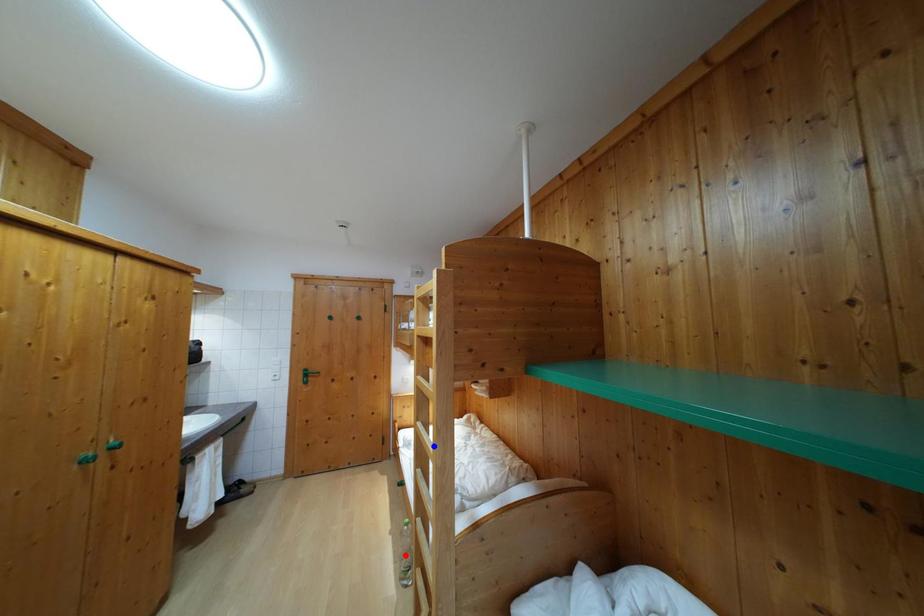
Question: In the image, two points are highlighted. Which point is nearer to the camera? Reply with the corresponding letter.

Choices:
 (A) blue point
 (B) red point

Answer: (A)